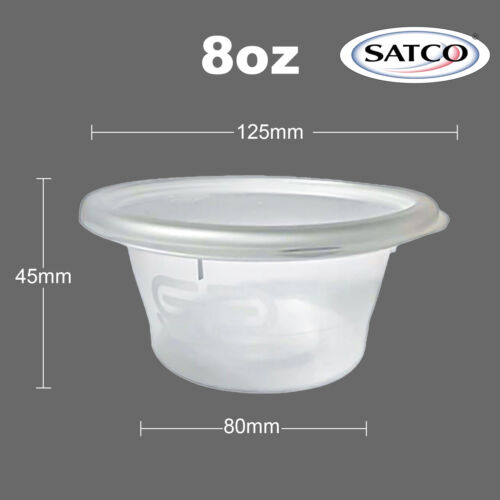
Identify the location of plastic lid. Image resolution: width=500 pixels, height=500 pixels. (307, 210).